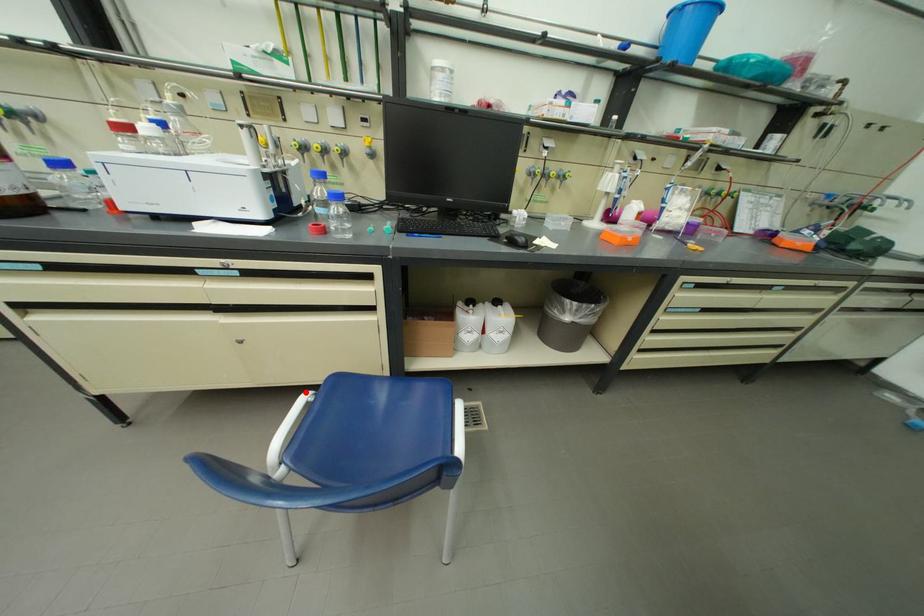
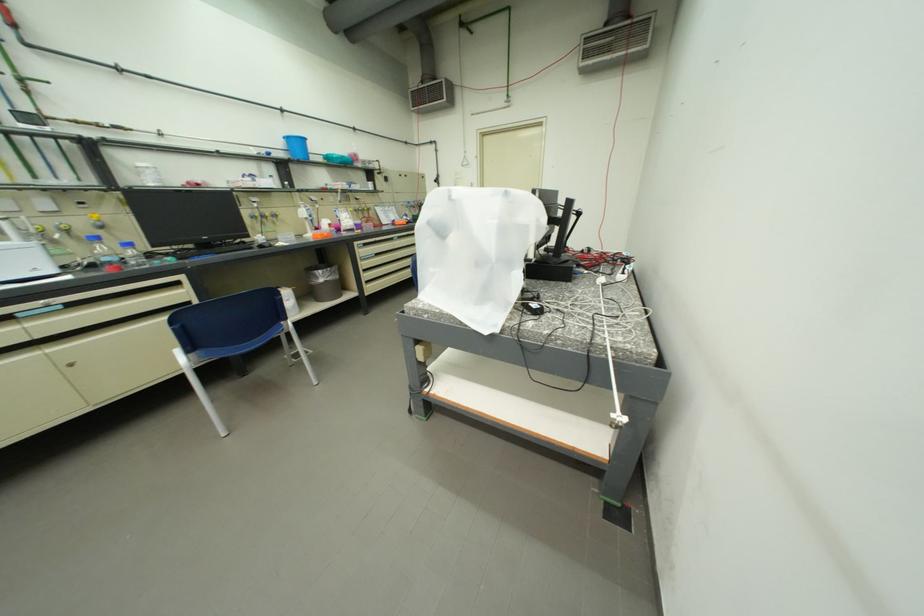
Question: I am providing you with two images of the same scene from different viewpoints. A red point is marked on the first image. At the location where the point appears in image 1, is it still visible in image 2?

Choices:
 (A) Yes
 (B) No

Answer: (B)